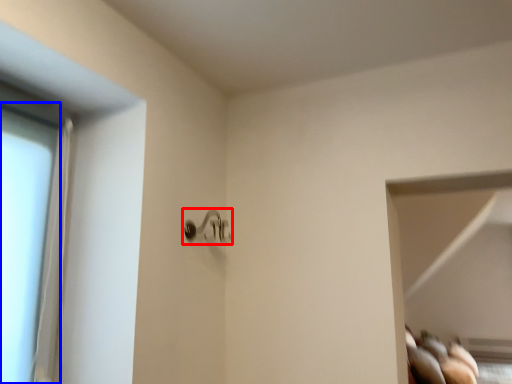
Question: Which object is further to the camera taking this photo, door handle (highlighted by a red box) or glass door (highlighted by a blue box)?

Choices:
 (A) door handle
 (B) glass door

Answer: (A)